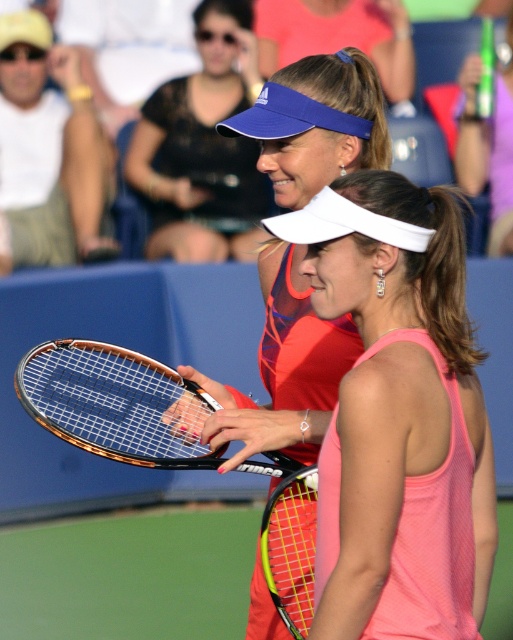
Does orange matte tennis racket at center have a smaller size compared to matte blue visor at upper center?

Correct, orange matte tennis racket at center occupies less space than matte blue visor at upper center.

Who is shorter, orange matte tennis racket at center or matte blue visor at upper center?

Standing shorter between the two is orange matte tennis racket at center.

The width and height of the screenshot is (513, 640). Describe the element at coordinates (116, 403) in the screenshot. I see `orange matte tennis racket at center` at that location.

At what (x,y) coordinates should I click in order to perform the action: click on orange matte tennis racket at center. Please return your answer as a coordinate pair (x, y). The width and height of the screenshot is (513, 640). Looking at the image, I should click on (116, 403).

The width and height of the screenshot is (513, 640). What do you see at coordinates (116, 403) in the screenshot?
I see `orange frame tennis racket at center` at bounding box center [116, 403].

At what (x,y) coordinates should I click in order to perform the action: click on orange frame tennis racket at center. Please return your answer as a coordinate pair (x, y). The image size is (513, 640). Looking at the image, I should click on (116, 403).

Can you confirm if matte orange tennis racket at center is smaller than matte blue visor at upper center?

Correct, matte orange tennis racket at center occupies less space than matte blue visor at upper center.

Between matte orange tennis racket at center and matte blue visor at upper center, which one appears on the right side from the viewer's perspective?

matte orange tennis racket at center is more to the right.

You are a GUI agent. You are given a task and a screenshot of the screen. Output one action in this format:
    pyautogui.click(x=<x>, y=<y>)
    Task: Click on the matte orange tennis racket at center
    The height and width of the screenshot is (640, 513).
    Given the screenshot: What is the action you would take?
    pyautogui.click(x=285, y=368)